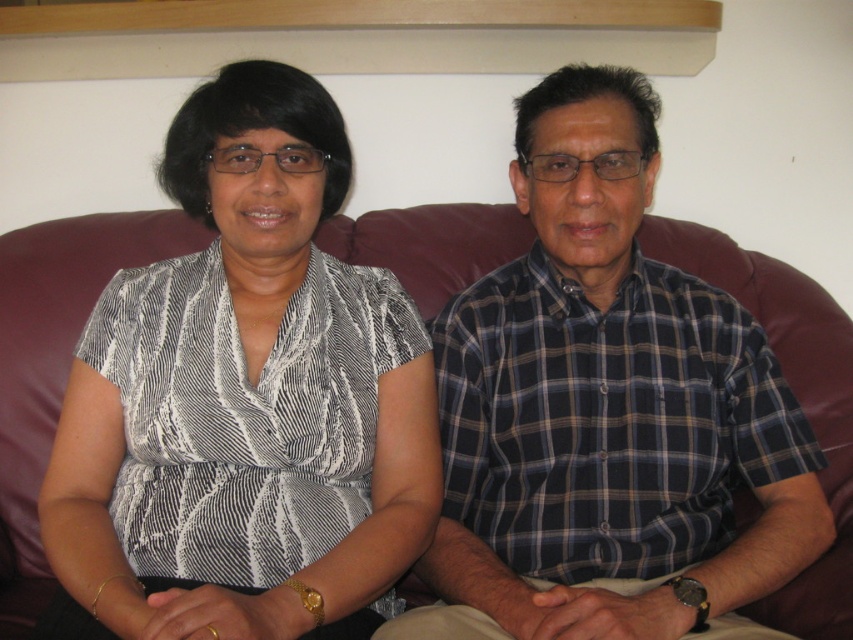
Does matte black blouse at left appear on the left side of plaid cotton shirt at center?

Correct, you'll find matte black blouse at left to the left of plaid cotton shirt at center.

Measure the distance between point (289, 483) and camera.

Point (289, 483) is 1.09 meters from camera.

The height and width of the screenshot is (640, 853). What do you see at coordinates (245, 396) in the screenshot?
I see `matte black blouse at left` at bounding box center [245, 396].

This screenshot has width=853, height=640. I want to click on matte black blouse at left, so click(x=245, y=396).

Who is lower down, plaid cotton shirt at center or leather couch at center?

leather couch at center

Is point (642, 600) farther from viewer compared to point (38, 563)?

No, (642, 600) is in front of (38, 563).

The height and width of the screenshot is (640, 853). I want to click on plaid cotton shirt at center, so click(605, 410).

You are a GUI agent. You are given a task and a screenshot of the screen. Output one action in this format:
    pyautogui.click(x=<x>, y=<y>)
    Task: Click on the plaid cotton shirt at center
    The width and height of the screenshot is (853, 640).
    Given the screenshot: What is the action you would take?
    point(605,410)

Which is behind, point (229, 419) or point (456, 273)?

The point (456, 273) is more distant.

Between matte black blouse at left and leather couch at center, which one appears on the right side from the viewer's perspective?

leather couch at center is more to the right.

Find the location of a particular element. Image resolution: width=853 pixels, height=640 pixels. matte black blouse at left is located at coordinates (245, 396).